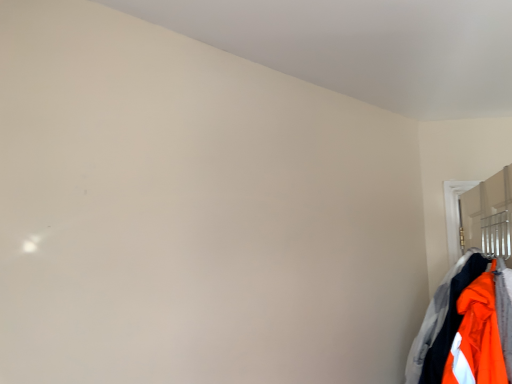
Image resolution: width=512 pixels, height=384 pixels. What do you see at coordinates (433, 321) in the screenshot? I see `orange fabric coat at right` at bounding box center [433, 321].

Where is `orange fabric coat at right`? orange fabric coat at right is located at coordinates (433, 321).

Measure the distance between orange fabric coat at right and camera.

They are 1.45 meters apart.

The image size is (512, 384). I want to click on orange fabric coat at right, so click(x=433, y=321).